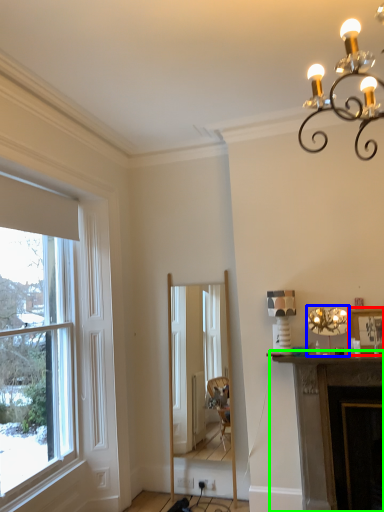
Question: Which object is the farthest from picture frame (highlighted by a red box)? Choose among these: lamp (highlighted by a blue box) or fireplace (highlighted by a green box).

Choices:
 (A) lamp
 (B) fireplace

Answer: (B)